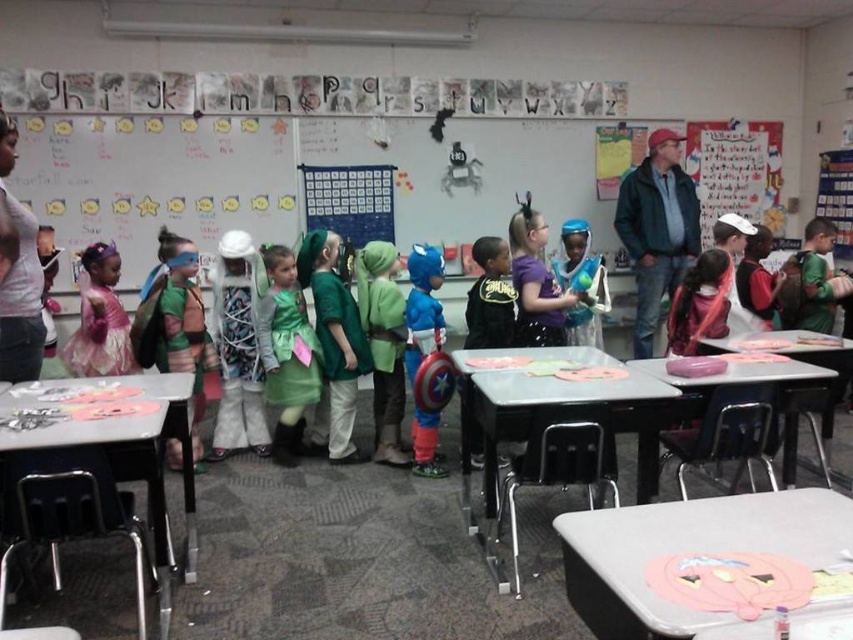
Which of these two, white paperboard at upper center or matte plastic table at center, stands taller?

With more height is white paperboard at upper center.

Does white paperboard at upper center appear on the left side of matte plastic table at center?

Indeed, white paperboard at upper center is positioned on the left side of matte plastic table at center.

Which is in front, point (405, 209) or point (735, 374)?

Positioned in front is point (735, 374).

Find the location of a particular element. The height and width of the screenshot is (640, 853). white paperboard at upper center is located at coordinates (297, 179).

Which is below, white plastic table at lower right or denim jacket at right?

white plastic table at lower right

Based on the photo, which of these two, white plastic table at lower right or denim jacket at right, stands shorter?

white plastic table at lower right

Where is `white plastic table at lower right`? Image resolution: width=853 pixels, height=640 pixels. white plastic table at lower right is located at coordinates (688, 552).

Is metallic gray table at lower left below green satin dress at center?

Yes, metallic gray table at lower left is below green satin dress at center.

Can you confirm if metallic gray table at lower left is thinner than green satin dress at center?

In fact, metallic gray table at lower left might be wider than green satin dress at center.

Locate an element on the screen. This screenshot has width=853, height=640. metallic gray table at lower left is located at coordinates (128, 451).